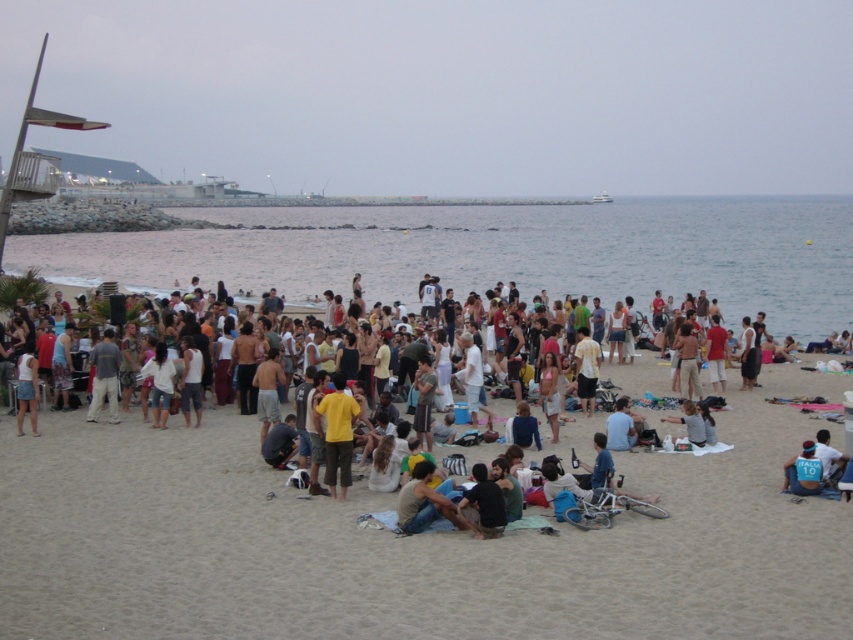
Question: Is yellow cotton shirt at center to the right of blue jersey at lower right from the viewer's perspective?

Choices:
 (A) no
 (B) yes

Answer: (A)

Question: Does clear blue water at center appear over jeans at center?

Choices:
 (A) yes
 (B) no

Answer: (A)

Question: Estimate the real-world distances between objects in this image. Which object is farther from the yellow matte shirt at center?

Choices:
 (A) blue jersey at lower right
 (B) clear blue water at center
 (C) jeans at center

Answer: (B)

Question: Which object is the farthest from the blue jersey at lower right?

Choices:
 (A) clear blue water at center
 (B) jeans at center

Answer: (A)

Question: Is yellow matte shirt at center thinner than yellow cotton shirt at center?

Choices:
 (A) yes
 (B) no

Answer: (B)

Question: Which point is farther to the camera?

Choices:
 (A) light beige sand at center
 (B) clear blue water at center

Answer: (B)